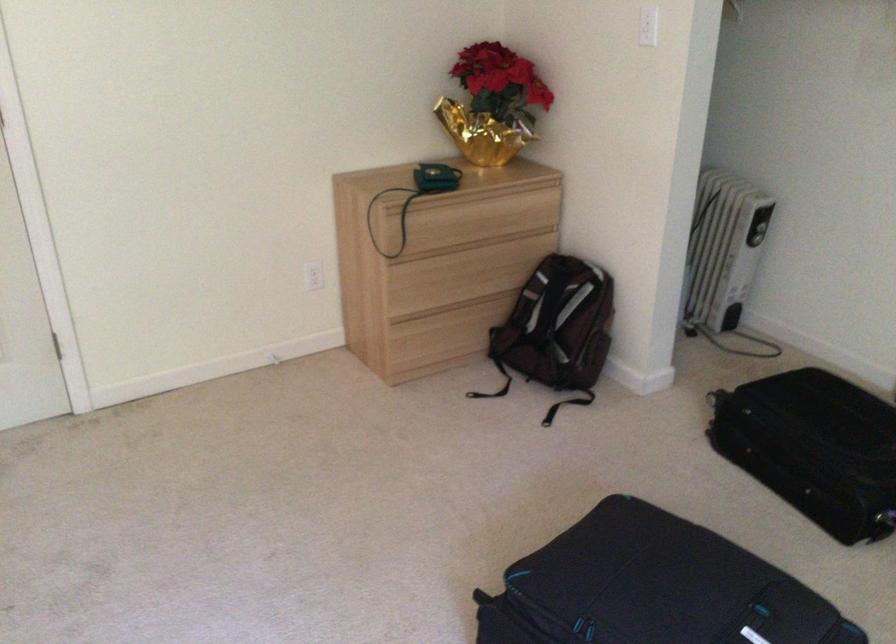
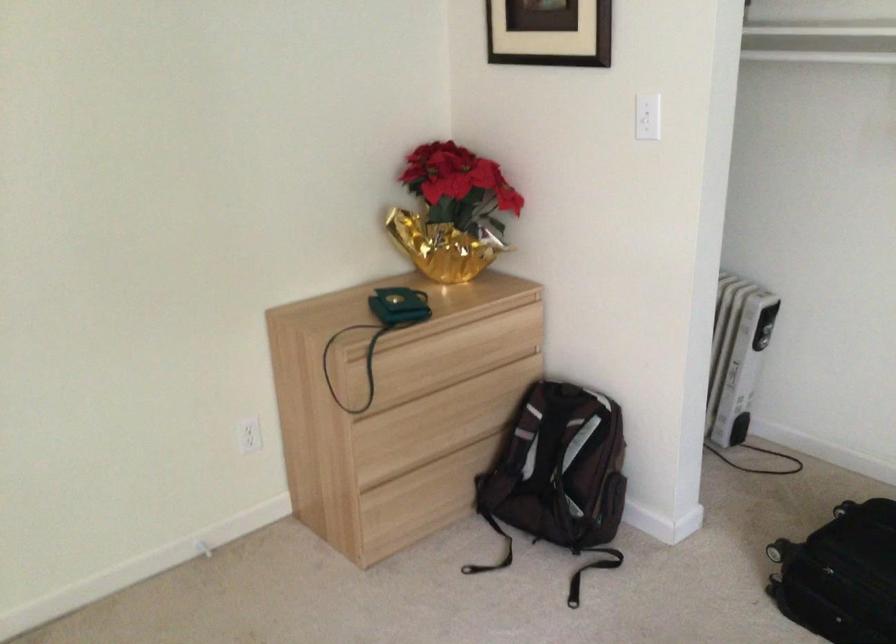
Locate, in the second image, the point that corresponds to pixel 455 277 in the first image.

(434, 424)